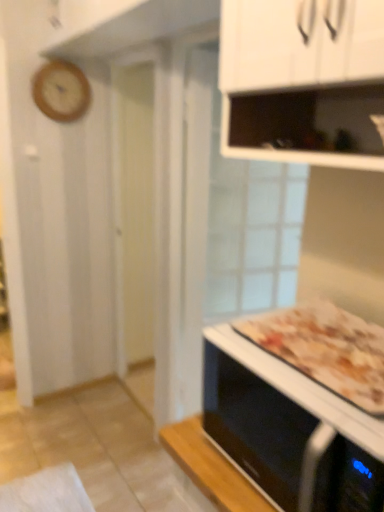
Identify the location of vacant region under golden brown crusty pizza at lower right (from a real-world perspective). Image resolution: width=384 pixels, height=512 pixels. (338, 354).